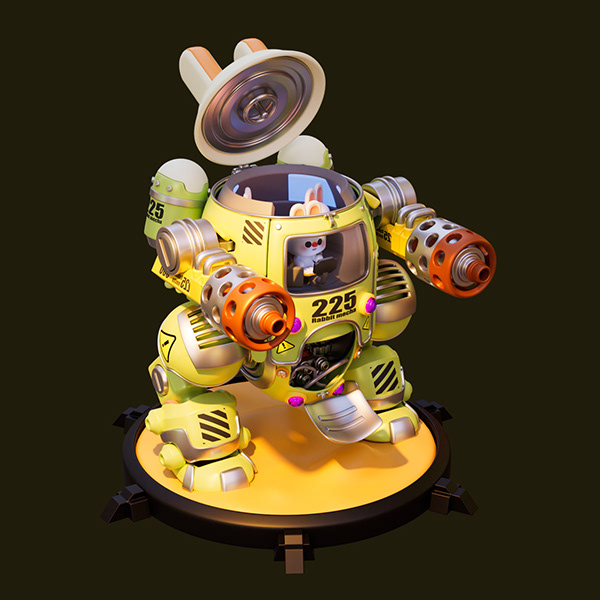
Identify the location of black pad stand. (175, 508).